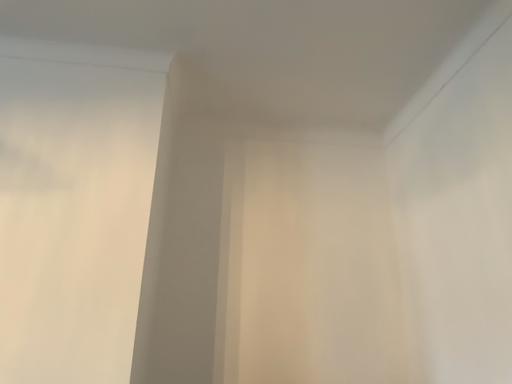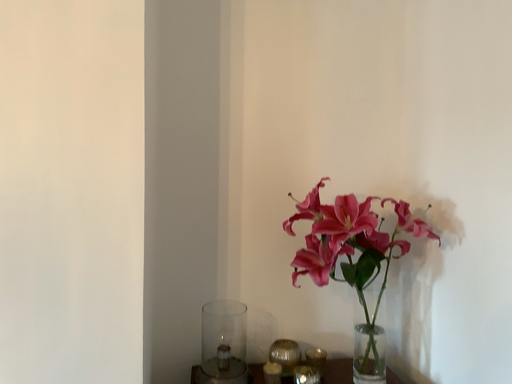
Question: Which way did the camera rotate in the video?

Choices:
 (A) rotated downward
 (B) rotated upward

Answer: (A)